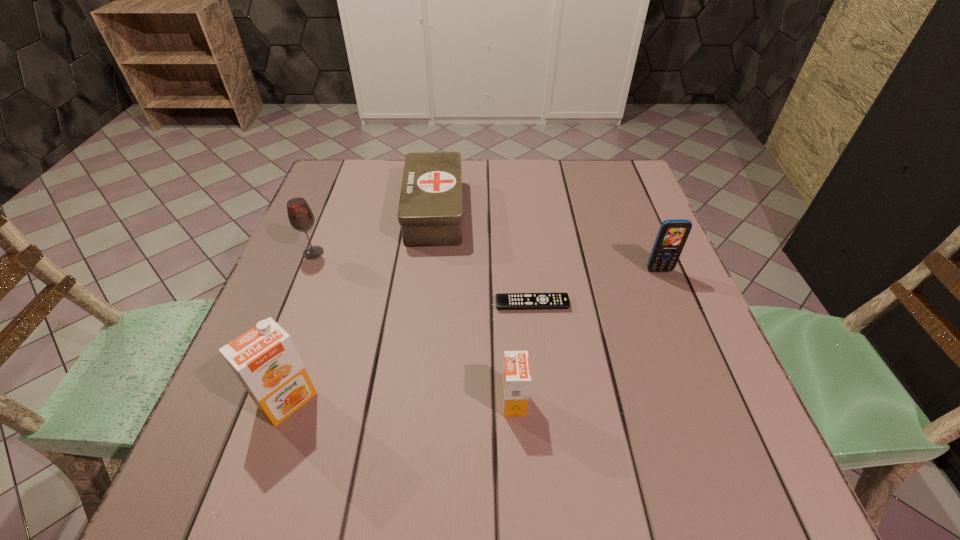
The orange juices are evenly distributed in the image. To maintain this, where would you place another orange juice on the right? Please point to a free space. Please provide its 2D coordinates. Your answer should be formatted as a tuple, i.e. [(x, y)], where the tuple contains the x and y coordinates of a point satisfying the conditions above.

[(741, 403)]